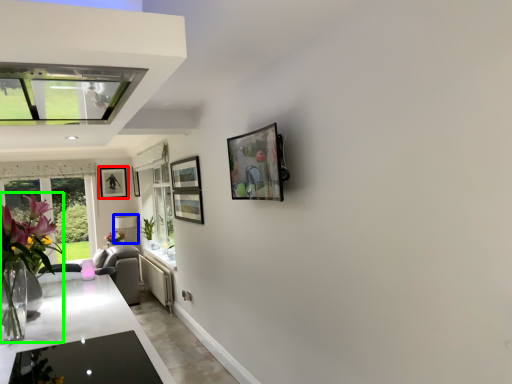
Question: Estimate the real-world distances between objects in this image. Which object is farther from picture frame (highlighted by a red box), lamp (highlighted by a blue box) or floral arrangement (highlighted by a green box)?

Choices:
 (A) lamp
 (B) floral arrangement

Answer: (B)